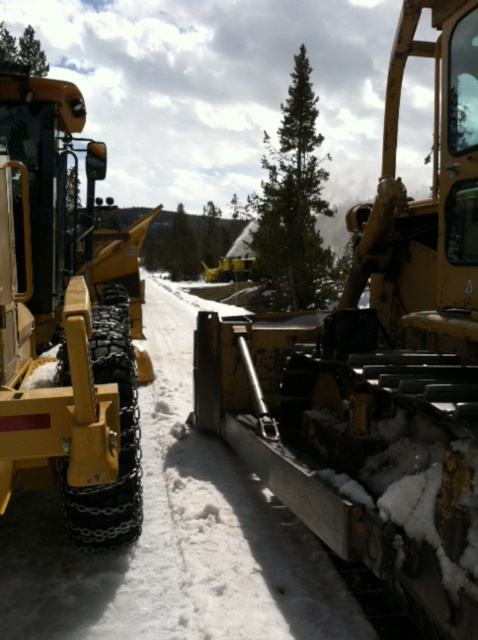
From the picture: You are a delivery driver needing to pass through the area where the matte yellow tractor at center and the green textured pine at center are located. Which object should you avoid hitting to ensure safe passage?

The matte yellow tractor at center has a smaller size compared to the green textured pine at center, so you should avoid hitting the green textured pine at center as it is larger and could cause more damage.

You are a maintenance worker who needs to choose a vehicle to reach a high platform. You have two options in the scene, the matte yellow tractor at center and the yellow rubber tractor at left. Which one would you choose and why?

You should choose the matte yellow tractor at center because it has a greater height compared to the yellow rubber tractor at left, making it more suitable for reaching high platforms.